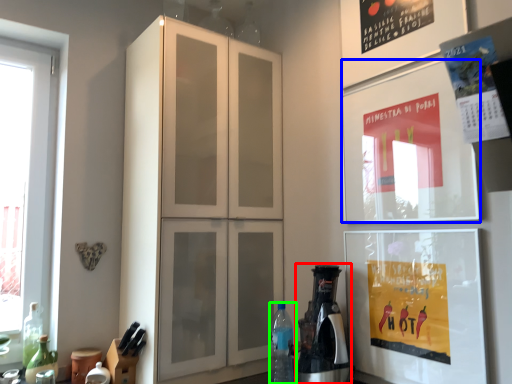
Question: Which object is positioned closest to coffee machine (highlighted by a red box)? Select from poster (highlighted by a blue box) and bottle (highlighted by a green box).

Choices:
 (A) poster
 (B) bottle

Answer: (B)